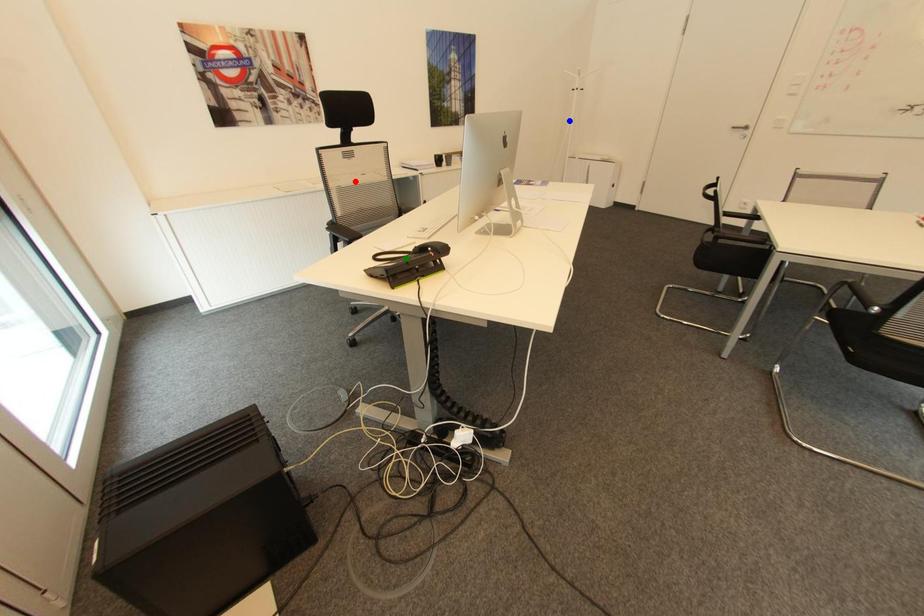
Based on the photo, order these from nearest to farthest:
red point
blue point
green point

green point
red point
blue point